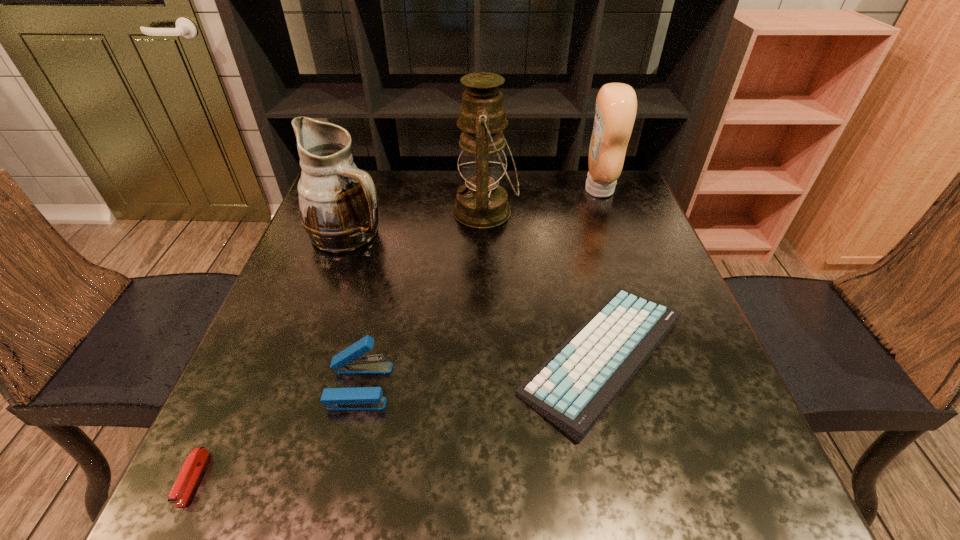
Locate an element on the screen. the tallest object is located at coordinates (481, 202).

Find the location of a particular element. This screenshot has height=540, width=960. condiment is located at coordinates (616, 104).

Where is `pitcher`? Image resolution: width=960 pixels, height=540 pixels. pitcher is located at coordinates (338, 202).

I want to click on the farther stapler, so click(x=348, y=361).

Where is `the taller stapler`? This screenshot has height=540, width=960. the taller stapler is located at coordinates (348, 361).

Identify the location of computer keyboard. The height and width of the screenshot is (540, 960). (573, 388).

Locate an element on the screen. the shorter stapler is located at coordinates (190, 471).

Image resolution: width=960 pixels, height=540 pixels. What are the coordinates of `the left stapler` in the screenshot? It's located at (190, 471).

Find the location of `vacant region located 0.060m on the front of the tallest object`. vacant region located 0.060m on the front of the tallest object is located at coordinates (486, 254).

Locate an element on the screen. vacant space located on the label of the condiment is located at coordinates (500, 190).